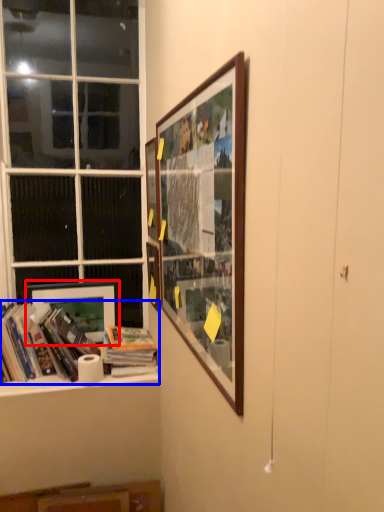
Question: Which of the following is the farthest to the observer, picture frame (highlighted by a red box) or book (highlighted by a blue box)?

Choices:
 (A) picture frame
 (B) book

Answer: (A)